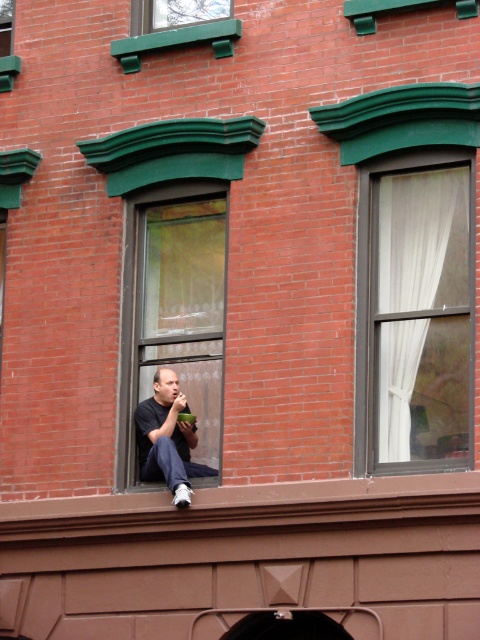
Can you confirm if dark blue jeans at center is shorter than green painted wood window at upper center?

Incorrect, dark blue jeans at center's height does not fall short of green painted wood window at upper center's.

Does dark blue jeans at center have a smaller size compared to green painted wood window at upper center?

Incorrect, dark blue jeans at center is not smaller in size than green painted wood window at upper center.

Identify the location of dark blue jeans at center. (168, 438).

Is white sheer curtain at upper right taller than green painted wood window at upper center?

Yes, white sheer curtain at upper right is taller than green painted wood window at upper center.

Does point (418, 394) come behind point (132, 1)?

No.

Locate an element on the screen. This screenshot has height=640, width=480. white sheer curtain at upper right is located at coordinates (422, 241).

Can you confirm if clear glass window at center is thinner than green painted wood window at upper center?

No, clear glass window at center is not thinner than green painted wood window at upper center.

Measure the distance between clear glass window at center and camera.

A distance of 71.86 feet exists between clear glass window at center and camera.

Where is `clear glass window at center`? The image size is (480, 640). clear glass window at center is located at coordinates (173, 307).

You are a GUI agent. You are given a task and a screenshot of the screen. Output one action in this format:
    pyautogui.click(x=<x>, y=<y>)
    Task: Click on the clear glass window at center
    The height and width of the screenshot is (640, 480).
    Given the screenshot: What is the action you would take?
    pyautogui.click(x=173, y=307)